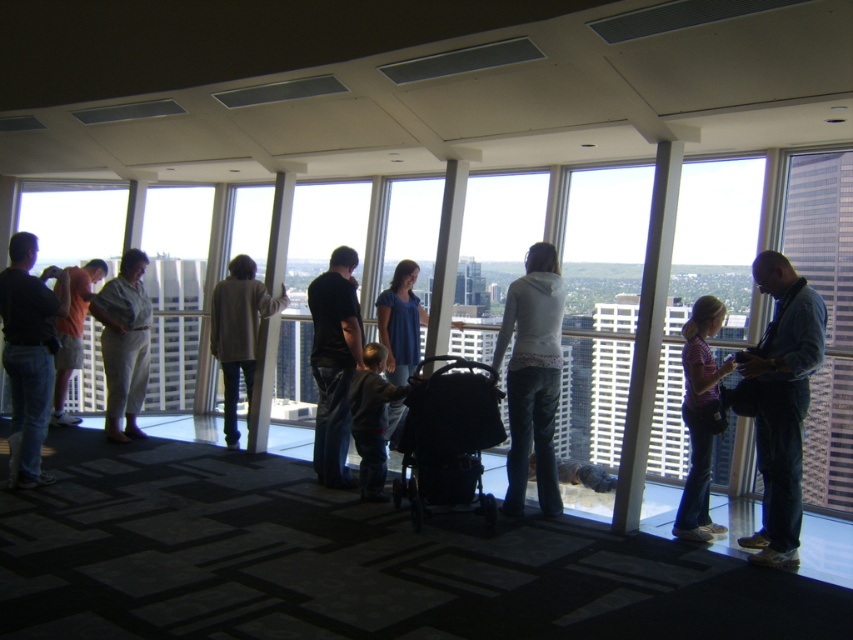
You are a photographer positioned at the back of the observation deck. You want to capture a photo of both the dark gray fleece jacket at center and the blue cotton shirt at center. Since you can only focus on one subject at a time, which one should you focus on first to ensure both are in the frame?

The dark gray fleece jacket at center is in front of the blue cotton shirt at center, so you should focus on the dark gray fleece jacket at center first to ensure both are in the frame.

You are a photographer standing at the center of the observation deck. You notice two people wearing a dark gray fleece jacket at center and a blue cotton shirt at center. Which clothing item is positioned lower on the person?

The dark gray fleece jacket at center is located below the blue cotton shirt at center, so the dark gray fleece jacket at center is positioned lower.